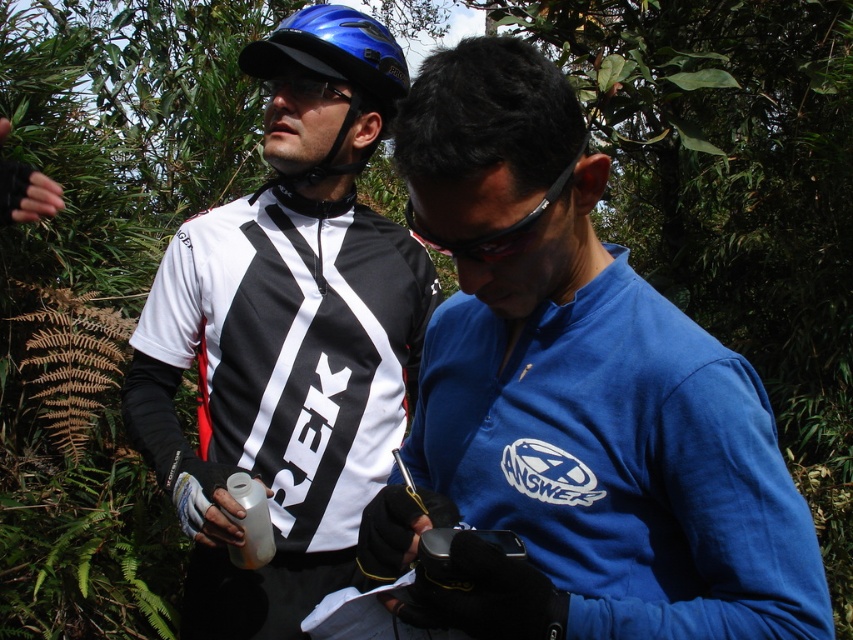
You are a photographer standing behind the two cyclists and want to take a photo focusing on the blue fabric shirt at center and the black plastic goggles at center. Which object will appear larger in the photo?

The blue fabric shirt at center will appear larger in the photo because it is closer to the viewer than the black plastic goggles at center.

You are a photographer standing 10 feet away from the two people in the scene. You want to take a photo that includes both the blue fabric shirt at center and the black plastic goggles at center without any part of them being cut off. What is the minimum width of your camera lens in inches to capture both items in the frame?

The blue fabric shirt at center and the black plastic goggles at center are 11.19 inches apart. To capture both items without any part being cut off, the minimum width of the camera lens should be at least 11.19 inches.

You are a cyclist in the image and want to move from the point at coordinates point (277, 140) to the point at coordinates point (309, 38). Which direction should you go?

You should move forward because point (277, 140) is behind point (309, 38).